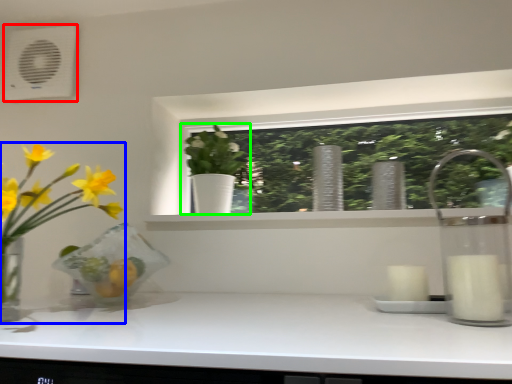
Question: Considering the real-world distances, which object is farthest from air conditioning (highlighted by a red box)? houseplant (highlighted by a blue box) or houseplant (highlighted by a green box)?

Choices:
 (A) houseplant
 (B) houseplant

Answer: (B)